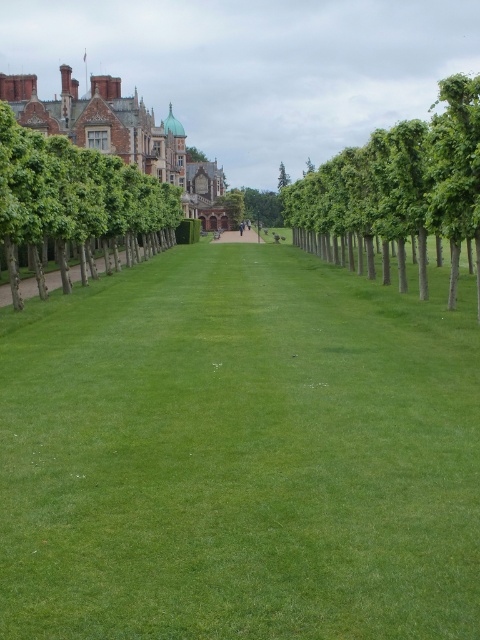
You are a gardener planning to plant additional shrubs along the green leafy trees at center and the smooth stone path at center. Based on their widths, which area would allow for more shrubs to be planted without overcrowding?

The green leafy trees at center might be wider than the smooth stone path at center, so planting more shrubs around the smooth stone path at center would be better to avoid overcrowding.

Looking at this image, you are standing at the entrance of the grand building and want to take a photo of the green leafy trees at center. Which direction should you face to capture them in your view?

The green leafy trees at center are located at point coordinates, so you should face towards the center area to capture them in your view.